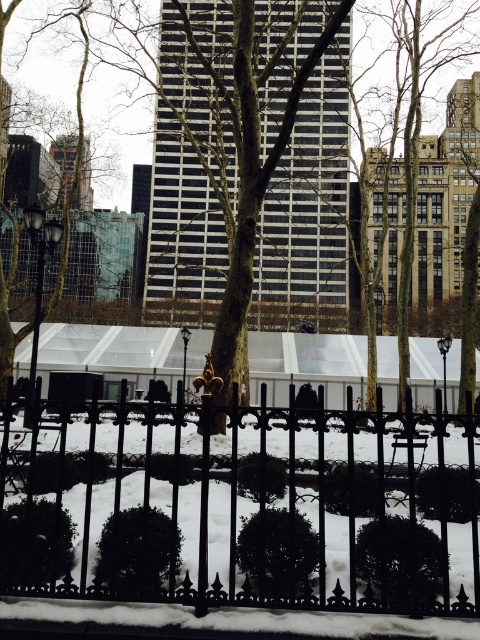
Question: Which point is closer to the camera?

Choices:
 (A) brown textured tree at center
 (B) black wrought iron fence at lower center

Answer: (B)

Question: Where is black wrought iron fence at lower center located in relation to brown textured tree at center in the image?

Choices:
 (A) above
 (B) below

Answer: (B)

Question: Which point is farther from the camera taking this photo?

Choices:
 (A) (443, 506)
 (B) (338, 282)

Answer: (B)

Question: Is black wrought iron fence at lower center below brown textured tree at center?

Choices:
 (A) no
 (B) yes

Answer: (B)

Question: Is black wrought iron fence at lower center further to the viewer compared to brown textured tree at center?

Choices:
 (A) no
 (B) yes

Answer: (A)